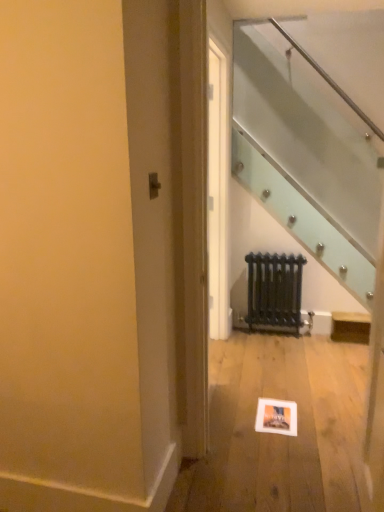
The width and height of the screenshot is (384, 512). Identify the location of empty space that is ontop of matte orange picture frame at lower center. (273, 409).